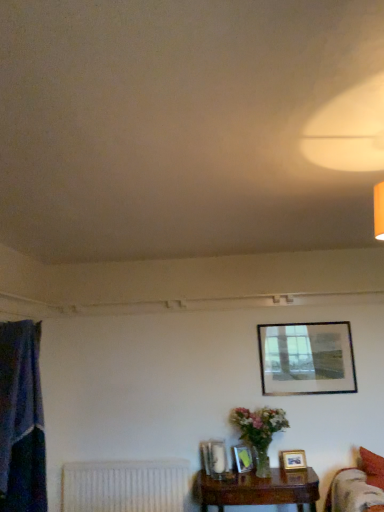
Question: Would you say blue fabric curtain at left is a long distance from matte plastic picture frame at lower center, acting as the first picture frame starting from the bottom?

Choices:
 (A) no
 (B) yes

Answer: (B)

Question: From the image's perspective, is blue fabric curtain at left over matte plastic picture frame at lower center, which is the second picture frame from left to right?

Choices:
 (A) yes
 (B) no

Answer: (A)

Question: From a real-world perspective, is blue fabric curtain at left positioned over matte plastic picture frame at lower center, acting as the first picture frame starting from the bottom, based on gravity?

Choices:
 (A) no
 (B) yes

Answer: (B)

Question: Is blue fabric curtain at left to the right of matte plastic picture frame at lower center, the 3th picture frame when ordered from right to left, from the viewer's perspective?

Choices:
 (A) no
 (B) yes

Answer: (A)

Question: Is blue fabric curtain at left facing away from matte plastic picture frame at lower center, placed as the fourth picture frame when sorted from top to bottom?

Choices:
 (A) no
 (B) yes

Answer: (A)

Question: Based on their positions, is brown wooden table at lower right located to the left or right of matte glass picture frame at lower center, acting as the 1th picture frame starting from the left?

Choices:
 (A) right
 (B) left

Answer: (A)

Question: In the image, is brown wooden table at lower right positioned in front of or behind matte glass picture frame at lower center, which is counted as the 3th picture frame, starting from the bottom?

Choices:
 (A) behind
 (B) front

Answer: (B)

Question: From the image's perspective, is brown wooden table at lower right located above or below matte glass picture frame at lower center, placed as the 4th picture frame when sorted from right to left?

Choices:
 (A) below
 (B) above

Answer: (A)

Question: Looking at their shapes, would you say brown wooden table at lower right is wider or thinner than matte glass picture frame at lower center, placed as the 4th picture frame when sorted from right to left?

Choices:
 (A) wide
 (B) thin

Answer: (A)

Question: Considering the positions of matte glass picture frame at lower center, placed as the 4th picture frame when sorted from right to left, and brown wooden table at lower right in the image, is matte glass picture frame at lower center, placed as the 4th picture frame when sorted from right to left, taller or shorter than brown wooden table at lower right?

Choices:
 (A) short
 (B) tall

Answer: (A)

Question: From the image's perspective, relative to brown wooden table at lower right, is matte glass picture frame at lower center, which is counted as the 3th picture frame, starting from the bottom, above or below?

Choices:
 (A) below
 (B) above

Answer: (B)

Question: From a real-world perspective, relative to brown wooden table at lower right, is matte glass picture frame at lower center, which is counted as the 3th picture frame, starting from the bottom, vertically above or below?

Choices:
 (A) below
 (B) above

Answer: (B)

Question: Is point (226, 465) closer or farther from the camera than point (220, 510)?

Choices:
 (A) farther
 (B) closer

Answer: (A)

Question: Is blue fabric curtain at left in front of or behind white textured radiator at lower left in the image?

Choices:
 (A) front
 (B) behind

Answer: (A)

Question: Considering the positions of blue fabric curtain at left and white textured radiator at lower left in the image, is blue fabric curtain at left wider or thinner than white textured radiator at lower left?

Choices:
 (A) thin
 (B) wide

Answer: (B)